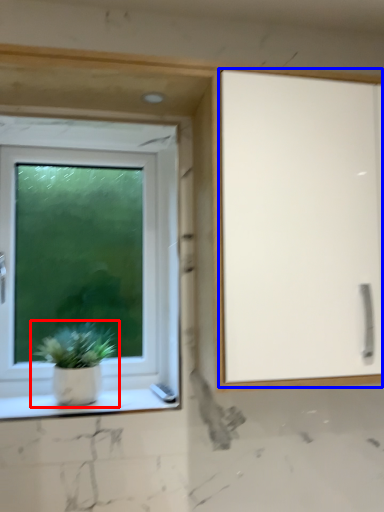
Question: Which of the following is the closest to the observer, houseplant (highlighted by a red box) or screen door (highlighted by a blue box)?

Choices:
 (A) houseplant
 (B) screen door

Answer: (B)